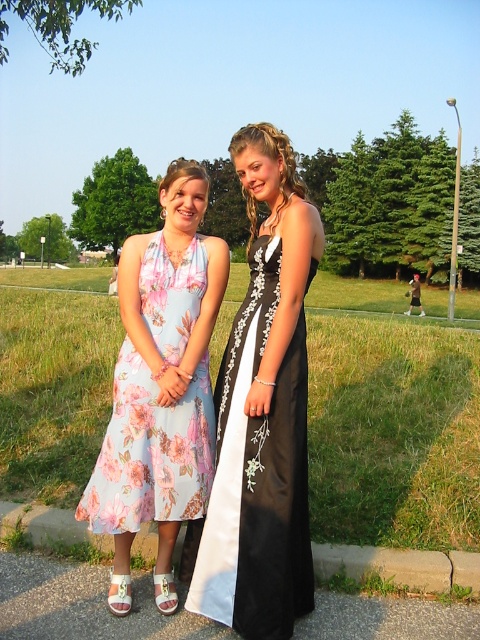
Question: Which point is farther from the camera taking this photo?

Choices:
 (A) (64, 541)
 (B) (120, 477)
 (C) (300, 522)

Answer: (A)

Question: Which of the following is the farthest from the observer?

Choices:
 (A) (430, 579)
 (B) (245, 298)

Answer: (A)

Question: Which of the following is the closest to the observer?

Choices:
 (A) black satin dress at center
 (B) concrete at lower center
 (C) floral silk dress at left

Answer: (A)

Question: Does black satin dress at center have a greater width compared to concrete at lower center?

Choices:
 (A) no
 (B) yes

Answer: (A)

Question: Is black satin dress at center thinner than concrete at lower center?

Choices:
 (A) yes
 (B) no

Answer: (A)

Question: Can you confirm if floral silk dress at left is positioned above concrete at lower center?

Choices:
 (A) yes
 (B) no

Answer: (A)